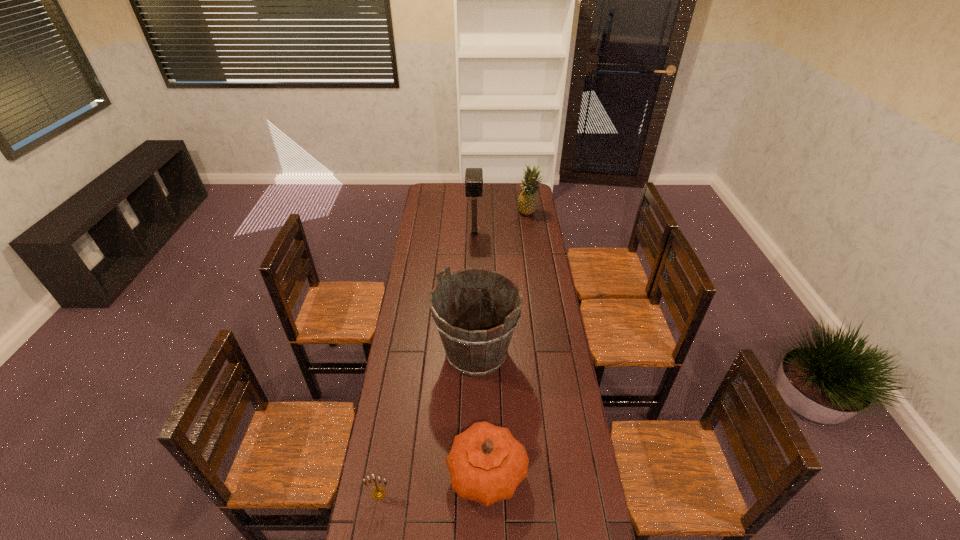
At what (x,y) coordinates should I click in order to perform the action: click on vacant space that is in between the mallet and the rightmost object. Please return your answer as a coordinate pair (x, y). Image resolution: width=960 pixels, height=540 pixels. Looking at the image, I should click on (501, 223).

I want to click on free space between the third farthest object and the pumpkin, so click(482, 413).

Where is `the second closest object to the fourth nearest object`? the second closest object to the fourth nearest object is located at coordinates (476, 343).

Find the location of a particular element. object that is the closest to the fourth tallest object is located at coordinates (378, 493).

The image size is (960, 540). I want to click on vacant region that satisfies the following two spatial constraints: 1. on the front side of the bucket; 2. on the right side of the mallet, so click(x=472, y=353).

At what (x,y) coordinates should I click in order to perform the action: click on vacant area in the image that satisfies the following two spatial constraints: 1. on the back side of the pineapple; 2. on the left side of the candelabrum. Please return your answer as a coordinate pair (x, y). The height and width of the screenshot is (540, 960). Looking at the image, I should click on (426, 212).

This screenshot has height=540, width=960. I want to click on vacant area in the image that satisfies the following two spatial constraints: 1. on the back side of the farthest object; 2. on the left side of the mallet, so (475, 212).